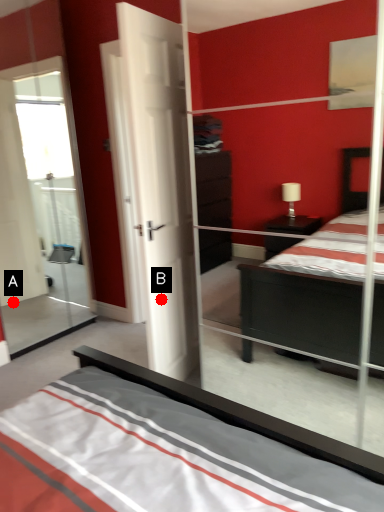
Question: Two points are circled on the image, labeled by A and B beside each circle. Which point is closer to the camera?

Choices:
 (A) A is closer
 (B) B is closer

Answer: (B)